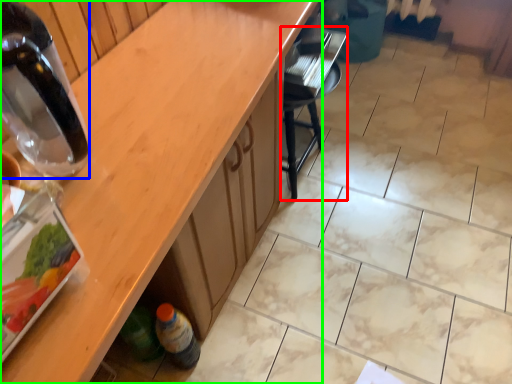
Question: Which object is positioned farthest from chair (highlighted by a red box)? Select from bottle (highlighted by a blue box) and countertop (highlighted by a green box).

Choices:
 (A) bottle
 (B) countertop

Answer: (A)